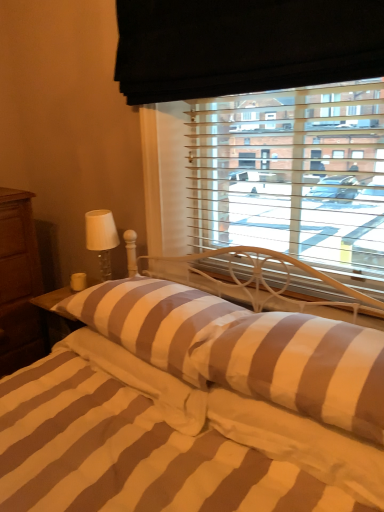
What do you see at coordinates (19, 283) in the screenshot?
I see `brown wood nightstand at left` at bounding box center [19, 283].

In order to click on striped fabric bed at center in this screenshot , I will do `click(194, 409)`.

Image resolution: width=384 pixels, height=512 pixels. Describe the element at coordinates (194, 409) in the screenshot. I see `striped fabric bed at center` at that location.

Image resolution: width=384 pixels, height=512 pixels. What do you see at coordinates (303, 368) in the screenshot?
I see `brown striped pillow at center, positioned as the 1th pillow in right-to-left order` at bounding box center [303, 368].

I want to click on brown striped pillow at center, positioned as the 1th pillow in right-to-left order, so click(x=303, y=368).

The image size is (384, 512). In order to click on brown striped pillow at center, the 1th pillow in the left-to-right sequence in this screenshot , I will do `click(155, 320)`.

The height and width of the screenshot is (512, 384). What do you see at coordinates (101, 238) in the screenshot?
I see `white glass table lamp at left` at bounding box center [101, 238].

This screenshot has height=512, width=384. Identify the location of brown wood nightstand at left. tap(19, 283).

Is brown striped pillow at center, positioned as the second pillow in left-to-right order, taller than striped fabric bed at center?

Incorrect, the height of brown striped pillow at center, positioned as the second pillow in left-to-right order, is not larger of that of striped fabric bed at center.

Considering their positions, is brown striped pillow at center, positioned as the 1th pillow in right-to-left order, located in front of or behind striped fabric bed at center?

Clearly, brown striped pillow at center, positioned as the 1th pillow in right-to-left order, is behind striped fabric bed at center.

How many degrees apart are the facing directions of brown striped pillow at center, positioned as the 1th pillow in right-to-left order, and striped fabric bed at center?

There is a 6.6e-05-degree angle between the facing directions of brown striped pillow at center, positioned as the 1th pillow in right-to-left order, and striped fabric bed at center.

From a real-world perspective, does brown striped pillow at center, positioned as the 1th pillow in right-to-left order, stand above striped fabric bed at center?

Indeed, from a real-world perspective, brown striped pillow at center, positioned as the 1th pillow in right-to-left order, stands above striped fabric bed at center.

Which is behind, point (106, 278) or point (186, 382)?

The point (106, 278) is behind.

Is white glass table lamp at left not within striped fabric bed at center?

white glass table lamp at left is positioned outside striped fabric bed at center.

Which is in front, white glass table lamp at left or striped fabric bed at center?

striped fabric bed at center.

From the image's perspective, which one is positioned higher, brown wood nightstand at left or brown striped pillow at center, which is the second pillow from right to left?

brown striped pillow at center, which is the second pillow from right to left.

Is brown wood nightstand at left with brown striped pillow at center, which is the second pillow from right to left?

No, brown wood nightstand at left is not with brown striped pillow at center, which is the second pillow from right to left.

Which of these two, brown wood nightstand at left or brown striped pillow at center, the 1th pillow in the left-to-right sequence, is thinner?

brown wood nightstand at left is thinner.

Considering the relative sizes of brown wood nightstand at left and brown striped pillow at center, which is the second pillow from right to left, in the image provided, is brown wood nightstand at left bigger than brown striped pillow at center, which is the second pillow from right to left,?

Yes, brown wood nightstand at left is bigger than brown striped pillow at center, which is the second pillow from right to left.

From a real-world perspective, is brown striped pillow at center, which is the second pillow from right to left, physically below white glass table lamp at left?

Yes, from a real-world perspective, brown striped pillow at center, which is the second pillow from right to left, is below white glass table lamp at left.

From the image's perspective, is brown striped pillow at center, the 1th pillow in the left-to-right sequence, above white glass table lamp at left?

No, from the image's perspective, brown striped pillow at center, the 1th pillow in the left-to-right sequence, is not over white glass table lamp at left.

Is brown striped pillow at center, the 1th pillow in the left-to-right sequence, thinner than white glass table lamp at left?

In fact, brown striped pillow at center, the 1th pillow in the left-to-right sequence, might be wider than white glass table lamp at left.

Considering the relative sizes of brown striped pillow at center, which is the second pillow from right to left, and white glass table lamp at left in the image provided, is brown striped pillow at center, which is the second pillow from right to left, smaller than white glass table lamp at left?

No, brown striped pillow at center, which is the second pillow from right to left, is not smaller than white glass table lamp at left.

Is brown striped pillow at center, the 1th pillow in the left-to-right sequence, at the back of striped fabric bed at center?

Yes, striped fabric bed at center's orientation is away from brown striped pillow at center, the 1th pillow in the left-to-right sequence.

Is striped fabric bed at center not inside brown striped pillow at center, which is the second pillow from right to left?

Yes, striped fabric bed at center is outside of brown striped pillow at center, which is the second pillow from right to left.

Which of these two, striped fabric bed at center or brown striped pillow at center, which is the second pillow from right to left, is wider?

striped fabric bed at center is wider.

From the picture: Considering the positions of objects striped fabric bed at center and brown striped pillow at center, the 1th pillow in the left-to-right sequence, in the image provided, who is behind, striped fabric bed at center or brown striped pillow at center, the 1th pillow in the left-to-right sequence,?

brown striped pillow at center, the 1th pillow in the left-to-right sequence.

Locate an element on the screen. pillow in front of the brown striped pillow at center, the 1th pillow in the left-to-right sequence is located at coordinates (303, 368).

From a real-world perspective, is brown striped pillow at center, positioned as the second pillow in left-to-right order, positioned over brown striped pillow at center, which is the second pillow from right to left, based on gravity?

Yes, from a real-world perspective, brown striped pillow at center, positioned as the second pillow in left-to-right order, is on top of brown striped pillow at center, which is the second pillow from right to left.

Considering the sizes of brown striped pillow at center, positioned as the second pillow in left-to-right order, and brown striped pillow at center, the 1th pillow in the left-to-right sequence, in the image, is brown striped pillow at center, positioned as the second pillow in left-to-right order, bigger or smaller than brown striped pillow at center, the 1th pillow in the left-to-right sequence,?

brown striped pillow at center, positioned as the second pillow in left-to-right order, is smaller than brown striped pillow at center, the 1th pillow in the left-to-right sequence.

From the image's perspective, does brown striped pillow at center, positioned as the 1th pillow in right-to-left order, appear lower than brown striped pillow at center, which is the second pillow from right to left?

Yes, from the image's perspective, brown striped pillow at center, positioned as the 1th pillow in right-to-left order, is beneath brown striped pillow at center, which is the second pillow from right to left.

Can you confirm if striped fabric bed at center is shorter than brown striped pillow at center, positioned as the 1th pillow in right-to-left order?

Incorrect, the height of striped fabric bed at center does not fall short of that of brown striped pillow at center, positioned as the 1th pillow in right-to-left order.

How many degrees apart are the facing directions of striped fabric bed at center and brown striped pillow at center, positioned as the second pillow in left-to-right order?

6.6e-05 degrees separate the facing orientations of striped fabric bed at center and brown striped pillow at center, positioned as the second pillow in left-to-right order.

In order to click on bed on the left side of brown striped pillow at center, positioned as the second pillow in left-to-right order in this screenshot , I will do `click(194, 409)`.

From the image's perspective, which pillow is the 1st one above the striped fabric bed at center? Please provide its 2D coordinates.

[(303, 368)]

Where is `table lamp located on the left of striped fabric bed at center`? table lamp located on the left of striped fabric bed at center is located at coordinates (101, 238).

In the scene shown: Which object lies nearer to the anchor point striped fabric bed at center, white glass table lamp at left or brown striped pillow at center, positioned as the second pillow in left-to-right order?

brown striped pillow at center, positioned as the second pillow in left-to-right order, lies closer to striped fabric bed at center than the other object.

Based on the photo, considering their positions, is white glass table lamp at left positioned closer to brown striped pillow at center, which is the second pillow from right to left, than striped fabric bed at center?

striped fabric bed at center lies closer to brown striped pillow at center, which is the second pillow from right to left, than the other object.

Looking at the image, which one is located further to brown striped pillow at center, which is the second pillow from right to left, brown striped pillow at center, positioned as the 1th pillow in right-to-left order, or white glass table lamp at left?

white glass table lamp at left is further to brown striped pillow at center, which is the second pillow from right to left.

Looking at the image, which one is located further to brown wood nightstand at left, brown striped pillow at center, positioned as the 1th pillow in right-to-left order, or white glass table lamp at left?

Among the two, brown striped pillow at center, positioned as the 1th pillow in right-to-left order, is located further to brown wood nightstand at left.

Looking at the image, which one is located closer to brown wood nightstand at left, brown striped pillow at center, the 1th pillow in the left-to-right sequence, or brown striped pillow at center, positioned as the second pillow in left-to-right order?

Based on the image, brown striped pillow at center, the 1th pillow in the left-to-right sequence, appears to be nearer to brown wood nightstand at left.

Considering their positions, is brown wood nightstand at left positioned further to brown striped pillow at center, the 1th pillow in the left-to-right sequence, than striped fabric bed at center?

The object further to brown striped pillow at center, the 1th pillow in the left-to-right sequence, is brown wood nightstand at left.

Estimate the real-world distances between objects in this image. Which object is further from striped fabric bed at center, brown wood nightstand at left or brown striped pillow at center, positioned as the second pillow in left-to-right order?

brown wood nightstand at left lies further to striped fabric bed at center than the other object.

Which object lies further to the anchor point brown wood nightstand at left, striped fabric bed at center or white glass table lamp at left?

striped fabric bed at center is positioned further to the anchor brown wood nightstand at left.

Locate an element on the screen. table lamp between brown wood nightstand at left and brown striped pillow at center, the 1th pillow in the left-to-right sequence, in the horizontal direction is located at coordinates (101, 238).

At what (x,y) coordinates should I click in order to perform the action: click on pillow between striped fabric bed at center and brown striped pillow at center, which is the second pillow from right to left, from front to back. Please return your answer as a coordinate pair (x, y). Looking at the image, I should click on (303, 368).

Where is `table lamp between brown wood nightstand at left and brown striped pillow at center, positioned as the second pillow in left-to-right order`? Image resolution: width=384 pixels, height=512 pixels. table lamp between brown wood nightstand at left and brown striped pillow at center, positioned as the second pillow in left-to-right order is located at coordinates (101, 238).

Where is `pillow between brown wood nightstand at left and brown striped pillow at center, positioned as the 1th pillow in right-to-left order`? pillow between brown wood nightstand at left and brown striped pillow at center, positioned as the 1th pillow in right-to-left order is located at coordinates (155, 320).